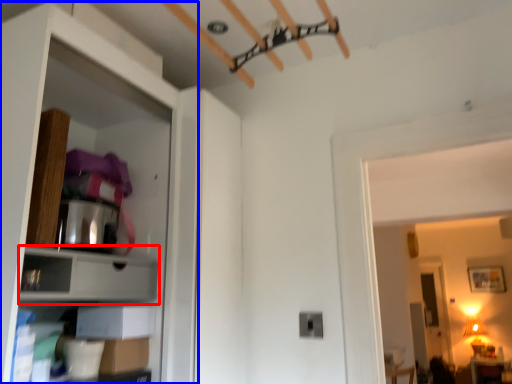
Question: Which object is closer to the camera taking this photo, cabinet (highlighted by a red box) or dresser (highlighted by a blue box)?

Choices:
 (A) cabinet
 (B) dresser

Answer: (B)